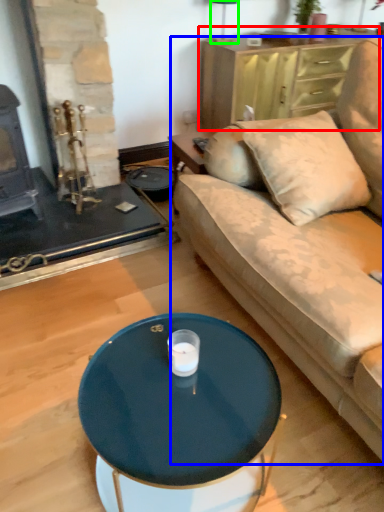
Question: Which object is positioned farthest from dresser (highlighted by a red box)? Select from studio couch (highlighted by a blue box) and lamp (highlighted by a green box).

Choices:
 (A) studio couch
 (B) lamp

Answer: (A)